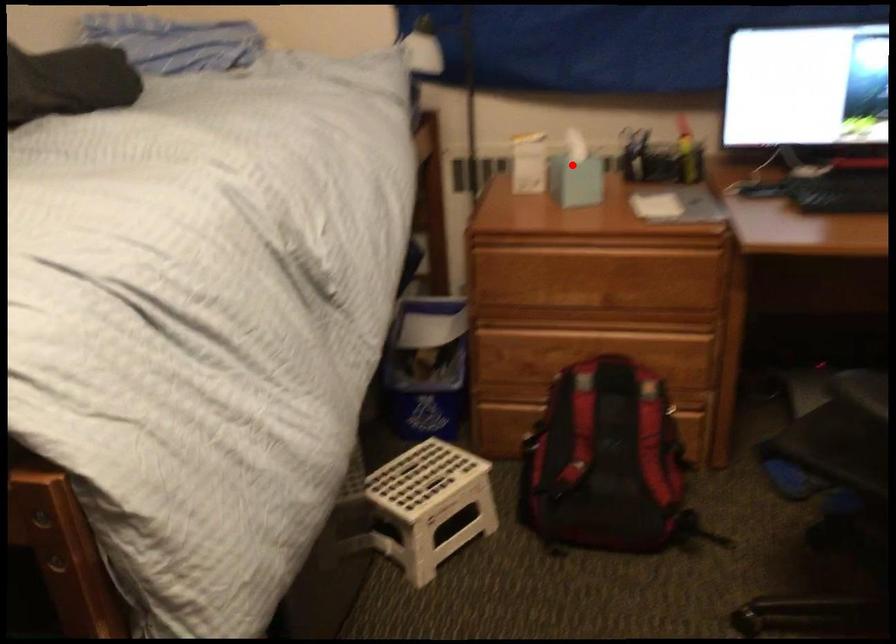
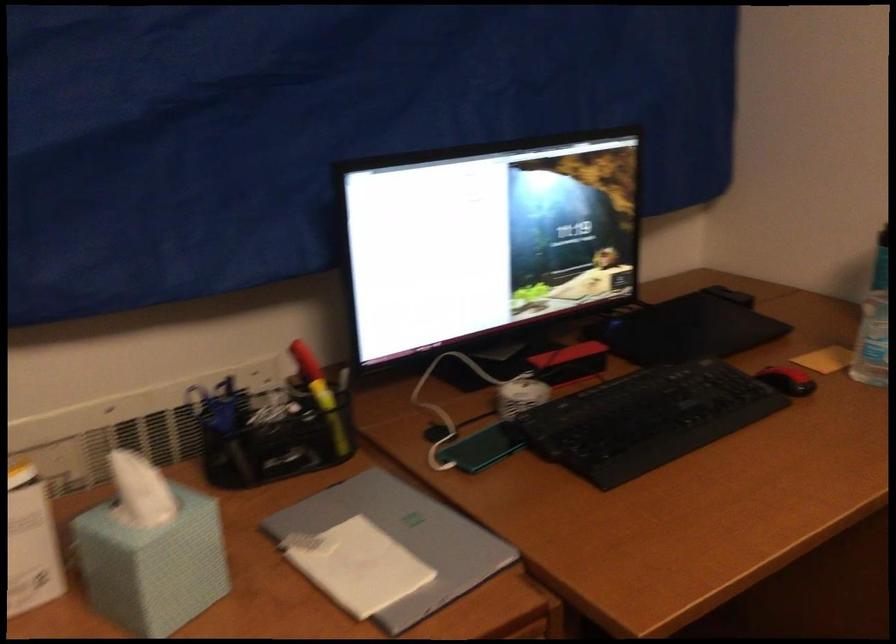
In the second image, find the point that corresponds to the highlighted location in the first image.

(150, 550)